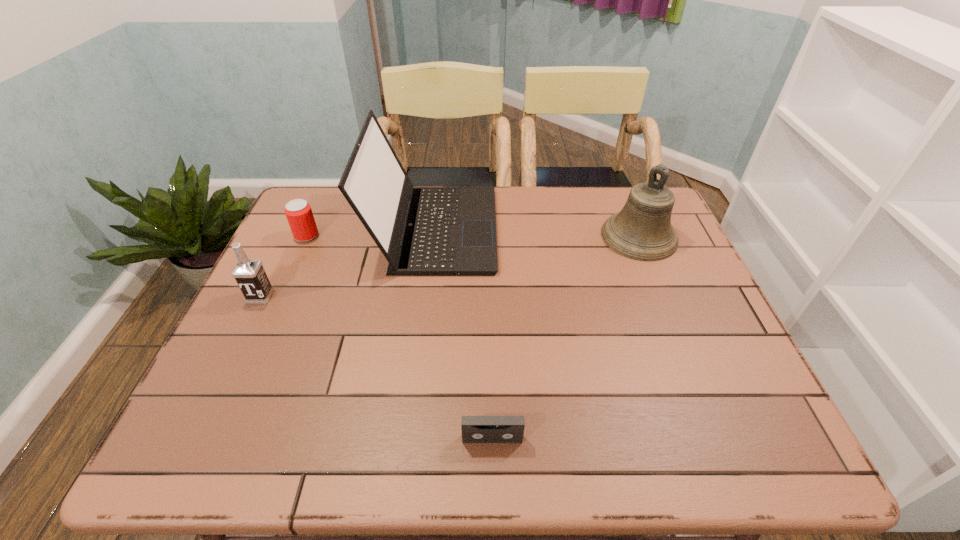
Find the location of a particular element. vacant space in between the laptop and the third shortest object is located at coordinates (348, 262).

At what (x,y) coordinates should I click in order to perform the action: click on free point between the vodka and the shortest object. Please return your answer as a coordinate pair (x, y). This screenshot has height=540, width=960. Looking at the image, I should click on tap(376, 368).

At what (x,y) coordinates should I click in order to perform the action: click on free space that is in between the third tallest object and the second shortest object. Please return your answer as a coordinate pair (x, y). This screenshot has width=960, height=540. Looking at the image, I should click on (283, 266).

Find the location of a particular element. The image size is (960, 540). object that is the fourth closest to the laptop is located at coordinates (475, 429).

Identify which object is located as the second nearest to the vodka. Please provide its 2D coordinates. Your answer should be formatted as a tuple, i.e. [(x, y)], where the tuple contains the x and y coordinates of a point satisfying the conditions above.

[(422, 231)]

You are a GUI agent. You are given a task and a screenshot of the screen. Output one action in this format:
    pyautogui.click(x=<x>, y=<y>)
    Task: Click on the free space that satisfies the following two spatial constraints: 1. on the surface of the laptop; 2. on the front side of the second shortest object
    Image resolution: width=960 pixels, height=540 pixels.
    Given the screenshot: What is the action you would take?
    pyautogui.click(x=434, y=235)

Identify the location of blank area in the image that satisfies the following two spatial constraints: 1. on the surface of the laptop; 2. on the left side of the bell. The image size is (960, 540). (434, 237).

Identify the location of vacant point that satisfies the following two spatial constraints: 1. on the front side of the beer can; 2. on the right side of the fourth shortest object. Image resolution: width=960 pixels, height=540 pixels. (306, 237).